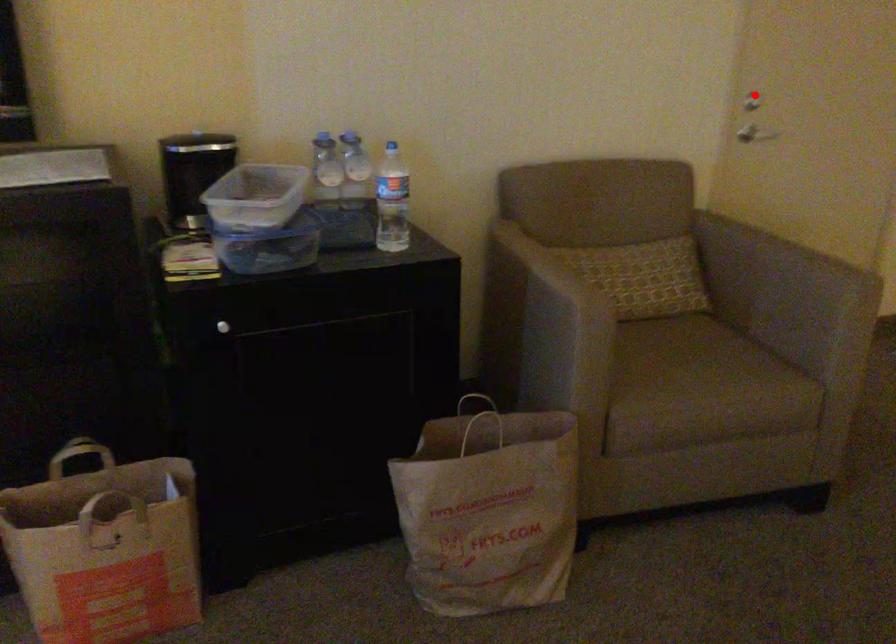
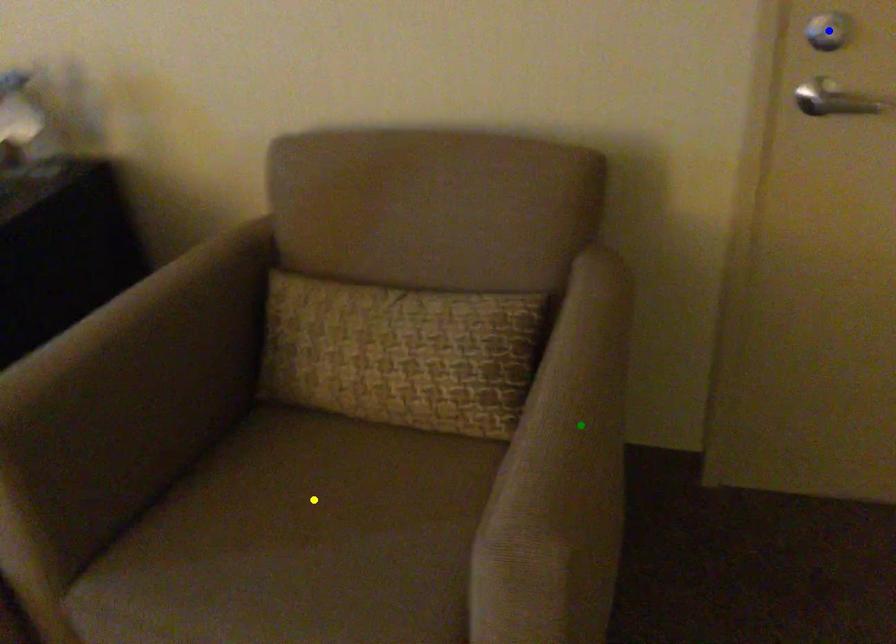
Question: I am providing you with two images of the same scene from different viewpoints. A red point is marked on the first image. You are given multiple points on the second image. Can you choose the point in image 2 that corresponds to the point in image 1?

Choices:
 (A) blue point
 (B) yellow point
 (C) green point

Answer: (A)